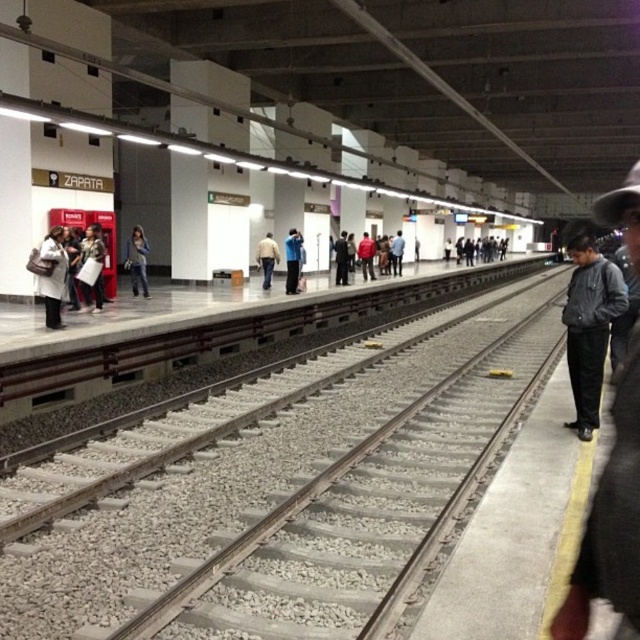
Question: Does matte black jacket at left appear on the left side of dark blue jeans at center?

Choices:
 (A) no
 (B) yes

Answer: (B)

Question: Which point is closer to the camera?

Choices:
 (A) gray gravel track at center
 (B) matte black jacket at left

Answer: (A)

Question: Can you confirm if denim pants at center is positioned to the right of dark blue jeans at center?

Choices:
 (A) yes
 (B) no

Answer: (B)

Question: Can you confirm if white fabric coat at left is positioned above dark blue jeans at center?

Choices:
 (A) yes
 (B) no

Answer: (B)

Question: Which object is closer to the camera taking this photo?

Choices:
 (A) denim pants at center
 (B) dark blue jacket at center
 (C) gray gravel track at center
 (D) dark blue jeans at center

Answer: (C)

Question: Among these points, which one is nearest to the camera?

Choices:
 (A) (632, 512)
 (B) (573, 401)
 (C) (278, 260)

Answer: (A)